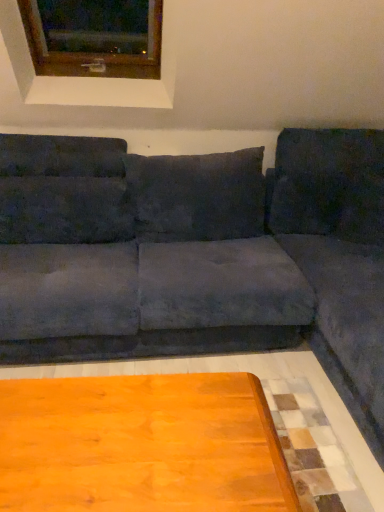
Question: Should I look upward or downward to see suede-like dark gray pillow at upper left, marked as the first pillow in a left-to-right arrangement?

Choices:
 (A) down
 (B) up

Answer: (B)

Question: Is suede gray couch at center bigger than wooden frame at upper left?

Choices:
 (A) no
 (B) yes

Answer: (B)

Question: From the image's perspective, is suede gray couch at center located above wooden frame at upper left?

Choices:
 (A) no
 (B) yes

Answer: (A)

Question: Is suede gray couch at center thinner than wooden frame at upper left?

Choices:
 (A) yes
 (B) no

Answer: (B)

Question: Is suede gray couch at center not inside wooden frame at upper left?

Choices:
 (A) yes
 (B) no

Answer: (A)

Question: From a real-world perspective, is suede gray couch at center located higher than wooden frame at upper left?

Choices:
 (A) yes
 (B) no

Answer: (B)

Question: Is suede gray couch at center looking in the opposite direction of wooden frame at upper left?

Choices:
 (A) no
 (B) yes

Answer: (A)

Question: From the image's perspective, does suede gray couch at center appear higher than suede-like dark gray pillow at upper left, positioned as the 3th pillow in right-to-left order?

Choices:
 (A) no
 (B) yes

Answer: (A)

Question: Considering the relative sizes of suede gray couch at center and suede-like dark gray pillow at upper left, positioned as the 3th pillow in right-to-left order, in the image provided, is suede gray couch at center shorter than suede-like dark gray pillow at upper left, positioned as the 3th pillow in right-to-left order,?

Choices:
 (A) no
 (B) yes

Answer: (A)

Question: Does suede gray couch at center have a greater height compared to suede-like dark gray pillow at upper left, positioned as the 3th pillow in right-to-left order?

Choices:
 (A) no
 (B) yes

Answer: (B)

Question: Are suede gray couch at center and suede-like dark gray pillow at upper left, marked as the first pillow in a left-to-right arrangement, located far from each other?

Choices:
 (A) yes
 (B) no

Answer: (B)

Question: Is suede gray couch at center looking in the opposite direction of suede-like dark gray pillow at upper left, positioned as the 3th pillow in right-to-left order?

Choices:
 (A) no
 (B) yes

Answer: (B)

Question: From the image's perspective, is suede gray couch at center under suede-like dark gray pillow at upper left, positioned as the 3th pillow in right-to-left order?

Choices:
 (A) no
 (B) yes

Answer: (B)

Question: Considering the relative sizes of velvet dark gray pillow at right, which appears as the first pillow when viewed from the right, and suede-like dark gray pillow at upper left, marked as the first pillow in a left-to-right arrangement, in the image provided, is velvet dark gray pillow at right, which appears as the first pillow when viewed from the right, wider than suede-like dark gray pillow at upper left, marked as the first pillow in a left-to-right arrangement,?

Choices:
 (A) no
 (B) yes

Answer: (B)